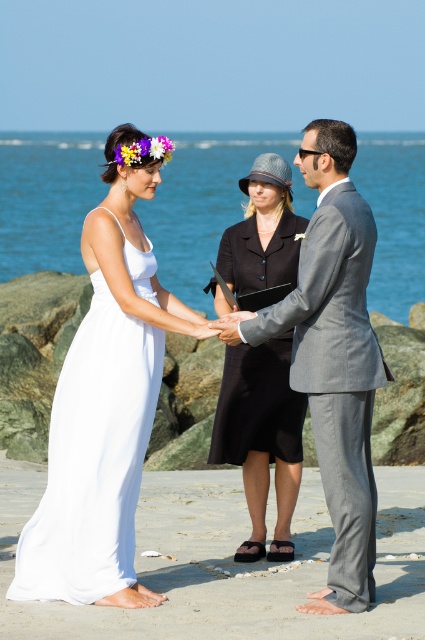
Question: Does white satin dress at center have a larger size compared to black matte dress at center?

Choices:
 (A) no
 (B) yes

Answer: (B)

Question: Which object is the farthest from the gray suit at center?

Choices:
 (A) black matte dress at center
 (B) white satin dress at center
 (C) white silky dress at left

Answer: (A)

Question: From the image, what is the correct spatial relationship of white satin dress at center in relation to black matte dress at center?

Choices:
 (A) right
 (B) left

Answer: (B)

Question: Does gray suit at center have a lesser width compared to white silky dress at left?

Choices:
 (A) no
 (B) yes

Answer: (A)

Question: Which point is farther to the camera?

Choices:
 (A) white silky dress at left
 (B) gray suit at center
 (C) black matte dress at center

Answer: (C)

Question: Which object appears farthest from the camera in this image?

Choices:
 (A) white satin dress at center
 (B) black matte dress at center
 (C) gray suit at center
 (D) white silky dress at left

Answer: (B)